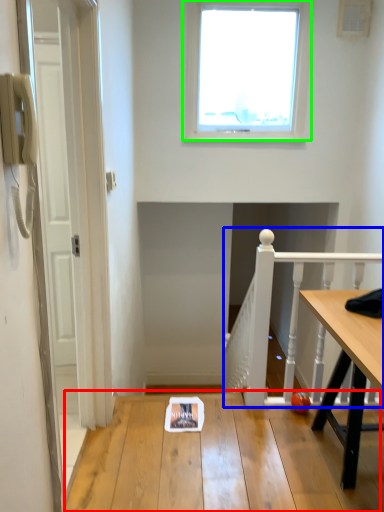
Question: Which object is positioned closest to table (highlighted by a red box)? Select from rail (highlighted by a blue box) and window (highlighted by a green box).

Choices:
 (A) rail
 (B) window

Answer: (A)